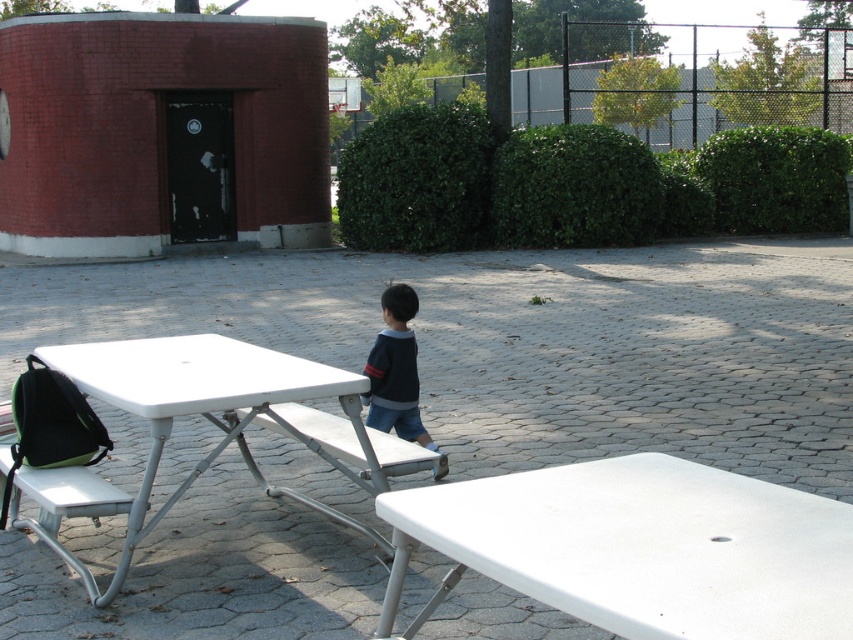
Between white plastic bench at center and dark blue striped sweater at center, which one has more height?

With more height is dark blue striped sweater at center.

What do you see at coordinates (343, 442) in the screenshot? I see `white plastic bench at center` at bounding box center [343, 442].

The width and height of the screenshot is (853, 640). In order to click on white plastic bench at center in this screenshot , I will do `click(343, 442)`.

Who is positioned more to the left, white plastic table at lower right or dark blue striped sweater at center?

From the viewer's perspective, dark blue striped sweater at center appears more on the left side.

Is white plastic table at lower right behind dark blue striped sweater at center?

No, it is in front of dark blue striped sweater at center.

This screenshot has width=853, height=640. Describe the element at coordinates (637, 548) in the screenshot. I see `white plastic table at lower right` at that location.

Find the location of a particular element. This screenshot has width=853, height=640. white plastic table at lower right is located at coordinates (637, 548).

Is white plastic table at lower right thinner than white plastic table at lower left?

Yes, white plastic table at lower right is thinner than white plastic table at lower left.

Measure the distance between white plastic table at lower right and camera.

white plastic table at lower right and camera are 6.92 feet apart from each other.

What do you see at coordinates (637, 548) in the screenshot? I see `white plastic table at lower right` at bounding box center [637, 548].

Identify the location of white plastic table at lower right. (637, 548).